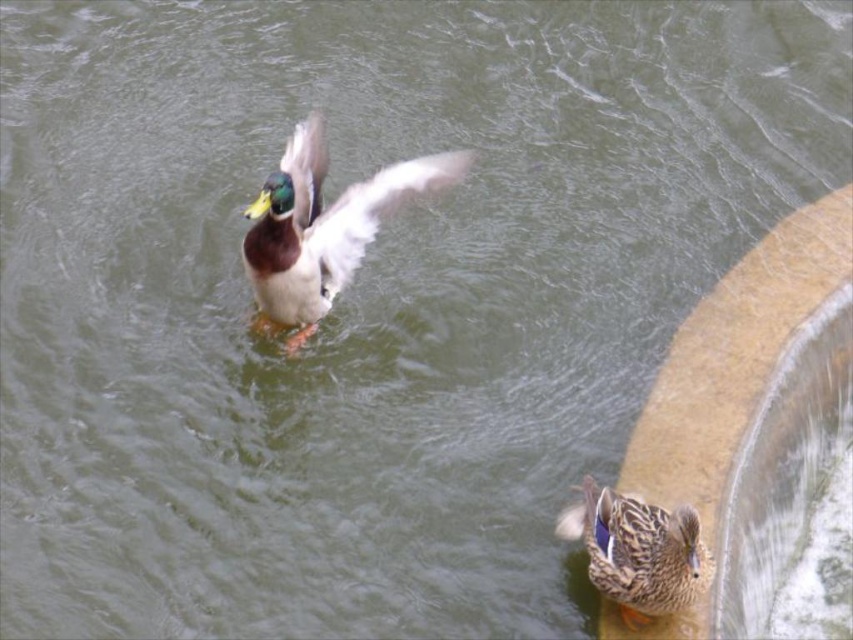
Between shiny green duck at upper center and brown speckled feathers at lower right, which one appears on the right side from the viewer's perspective?

Positioned to the right is brown speckled feathers at lower right.

Who is taller, shiny green duck at upper center or brown speckled feathers at lower right?

Standing taller between the two is shiny green duck at upper center.

Find the location of a particular element. shiny green duck at upper center is located at coordinates (321, 227).